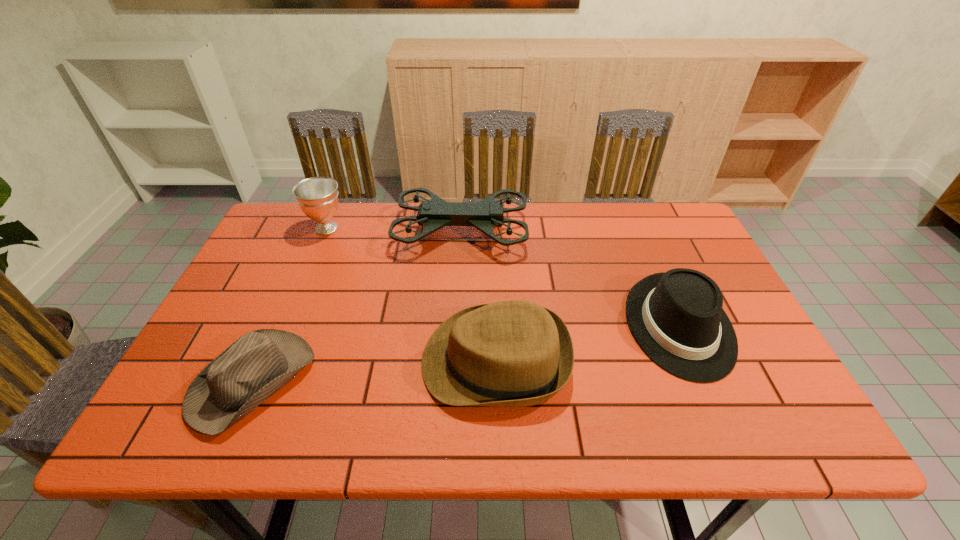
Where is `free space that satisfies the following two spatial constraints: 1. on the front-facing side of the rightmost fedora; 2. on the front-facing side of the second fedora from left to right`? This screenshot has width=960, height=540. free space that satisfies the following two spatial constraints: 1. on the front-facing side of the rightmost fedora; 2. on the front-facing side of the second fedora from left to right is located at coordinates (694, 361).

At what (x,y) coordinates should I click in order to perform the action: click on free spot that satisfies the following two spatial constraints: 1. on the front-facing side of the rightmost fedora; 2. on the front-facing side of the second fedora from right to left. Please return your answer as a coordinate pair (x, y). The image size is (960, 540). Looking at the image, I should click on (694, 361).